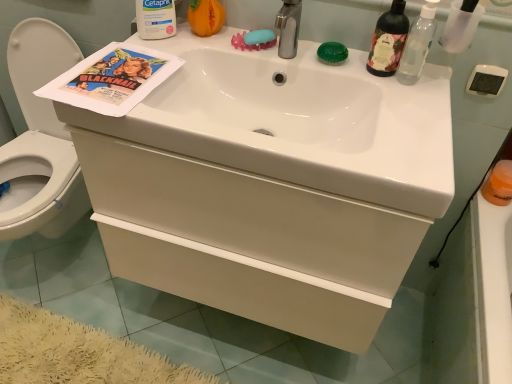
The image size is (512, 384). In order to click on free space in front of white matte lotion at upper center, which is counted as the 3th bottle, starting from the right in this screenshot , I will do `click(140, 61)`.